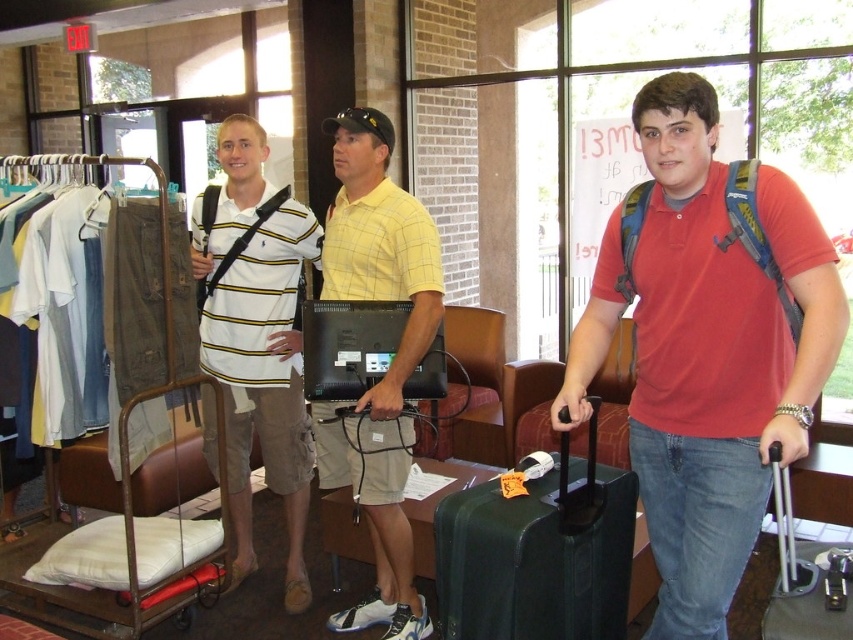
Looking at this image, does matte red polo shirt at center appear on the right side of black hard suitcase at center?

Incorrect, matte red polo shirt at center is not on the right side of black hard suitcase at center.

Is matte red polo shirt at center positioned at the back of black hard suitcase at center?

That is False.

Find the location of a particular element. This screenshot has width=853, height=640. matte red polo shirt at center is located at coordinates 706,346.

Which is more to the left, white striped polo shirt at left or yellow plaid shirt at center?

white striped polo shirt at left is more to the left.

Can you confirm if white striped polo shirt at left is positioned to the right of yellow plaid shirt at center?

Incorrect, white striped polo shirt at left is not on the right side of yellow plaid shirt at center.

Which is in front, point (263, 314) or point (396, 266)?

Point (396, 266) is in front.

Where is `white striped polo shirt at left`? The image size is (853, 640). white striped polo shirt at left is located at coordinates (257, 340).

Is matte red polo shirt at center below white striped polo shirt at left?

No.

Between matte red polo shirt at center and white striped polo shirt at left, which one appears on the left side from the viewer's perspective?

From the viewer's perspective, white striped polo shirt at left appears more on the left side.

Is point (646, 211) in front of point (222, 342)?

Yes, it is.

Locate an element on the screen. matte red polo shirt at center is located at coordinates (706, 346).